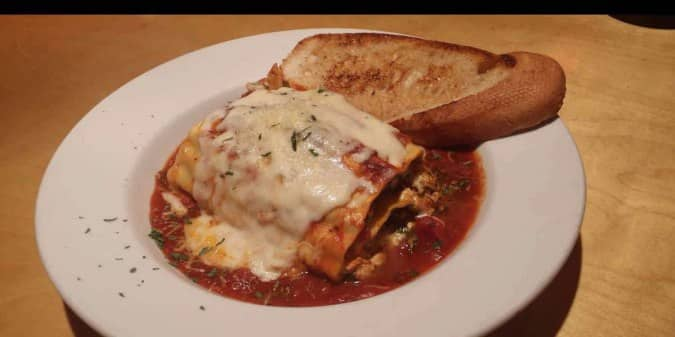
Where is `circular table cut-out`? Image resolution: width=675 pixels, height=337 pixels. circular table cut-out is located at coordinates (653, 26).